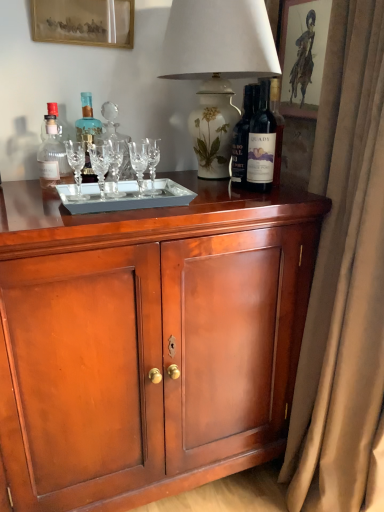
Where is `free point in front of dark glass bottle at upper right, which ranks as the third bottle in left-to-right order`? free point in front of dark glass bottle at upper right, which ranks as the third bottle in left-to-right order is located at coordinates (261, 207).